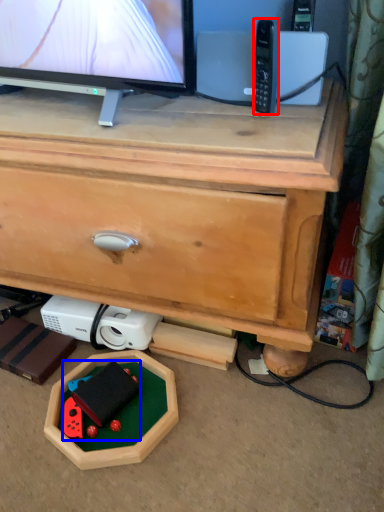
Question: Which object appears closest to the camera in this image, control (highlighted by a red box) or toy (highlighted by a blue box)?

Choices:
 (A) control
 (B) toy

Answer: (A)